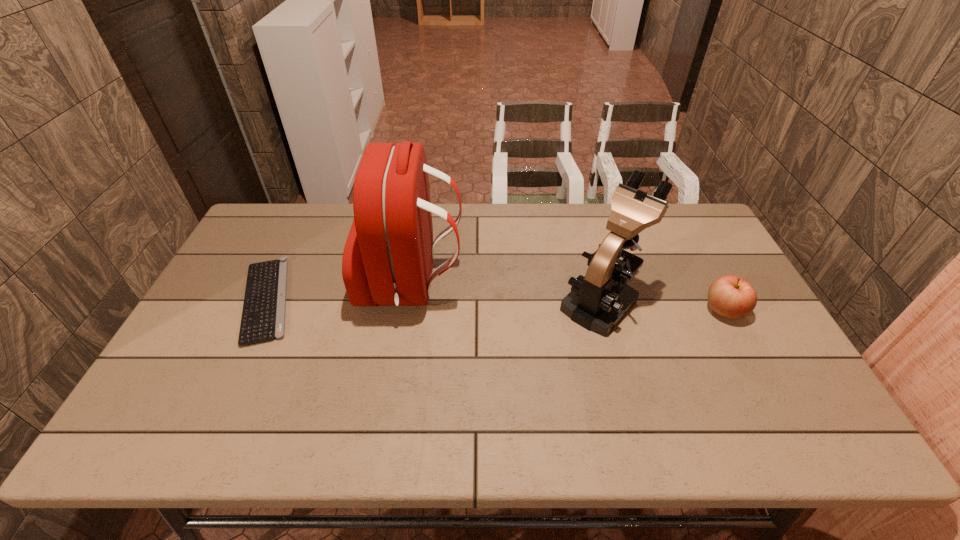
I want to click on vacant space that satisfies the following two spatial constraints: 1. on the strap side of the backpack; 2. on the right side of the apple, so click(408, 310).

Find the location of `free space that satisfies the following two spatial constraints: 1. on the front side of the leftmost object; 2. on the left side of the rightmost object`. free space that satisfies the following two spatial constraints: 1. on the front side of the leftmost object; 2. on the left side of the rightmost object is located at coordinates (261, 310).

Where is `vacant region that satisfies the following two spatial constraints: 1. on the front side of the shortest object; 2. on the right side of the microscope`? The height and width of the screenshot is (540, 960). vacant region that satisfies the following two spatial constraints: 1. on the front side of the shortest object; 2. on the right side of the microscope is located at coordinates (265, 302).